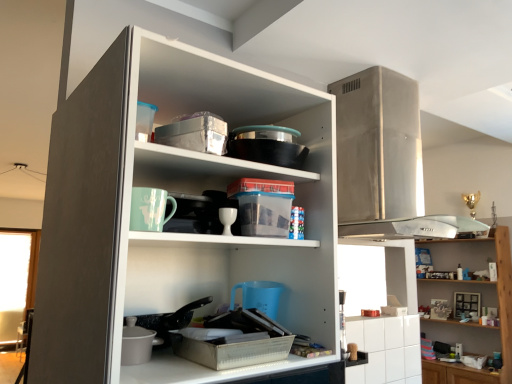
Question: Is white glossy cabinet at lower right smaller than wooden shelves at upper right?

Choices:
 (A) no
 (B) yes

Answer: (B)

Question: Would you say white glossy cabinet at lower right contains wooden shelves at upper right?

Choices:
 (A) no
 (B) yes

Answer: (A)

Question: From the image's perspective, is white glossy cabinet at lower right above wooden shelves at upper right?

Choices:
 (A) yes
 (B) no

Answer: (A)

Question: Does white glossy cabinet at lower right have a larger size compared to wooden shelves at upper right?

Choices:
 (A) yes
 (B) no

Answer: (B)

Question: Considering the relative sizes of white glossy cabinet at lower right and wooden shelves at upper right in the image provided, is white glossy cabinet at lower right thinner than wooden shelves at upper right?

Choices:
 (A) no
 (B) yes

Answer: (B)

Question: Can you confirm if white glossy cabinet at lower right is positioned to the left of wooden shelves at upper right?

Choices:
 (A) no
 (B) yes

Answer: (B)

Question: Is white glossy cabinet at lower right closer to camera compared to white glossy cup at center?

Choices:
 (A) yes
 (B) no

Answer: (B)

Question: Is white glossy cabinet at lower right thinner than white glossy cup at center?

Choices:
 (A) no
 (B) yes

Answer: (B)

Question: Does white glossy cabinet at lower right have a greater width compared to white glossy cup at center?

Choices:
 (A) no
 (B) yes

Answer: (A)

Question: Does white glossy cabinet at lower right appear on the right side of white glossy cup at center?

Choices:
 (A) yes
 (B) no

Answer: (A)

Question: Is white glossy cabinet at lower right smaller than white glossy cup at center?

Choices:
 (A) no
 (B) yes

Answer: (A)

Question: Is white glossy cabinet at lower right at the left side of white glossy cup at center?

Choices:
 (A) yes
 (B) no

Answer: (B)

Question: Can you confirm if white matte cupboard at center is wider than white glossy cup at center?

Choices:
 (A) yes
 (B) no

Answer: (A)